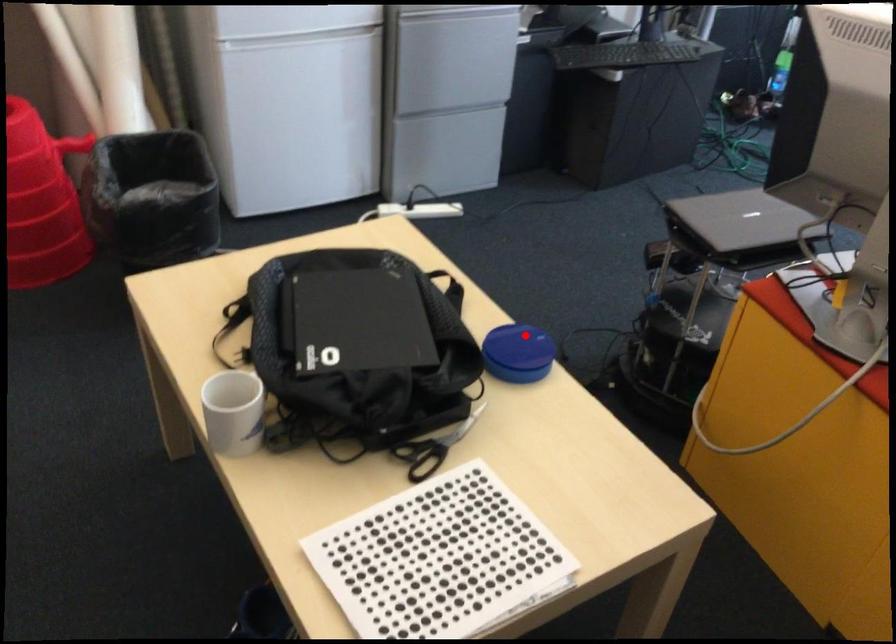
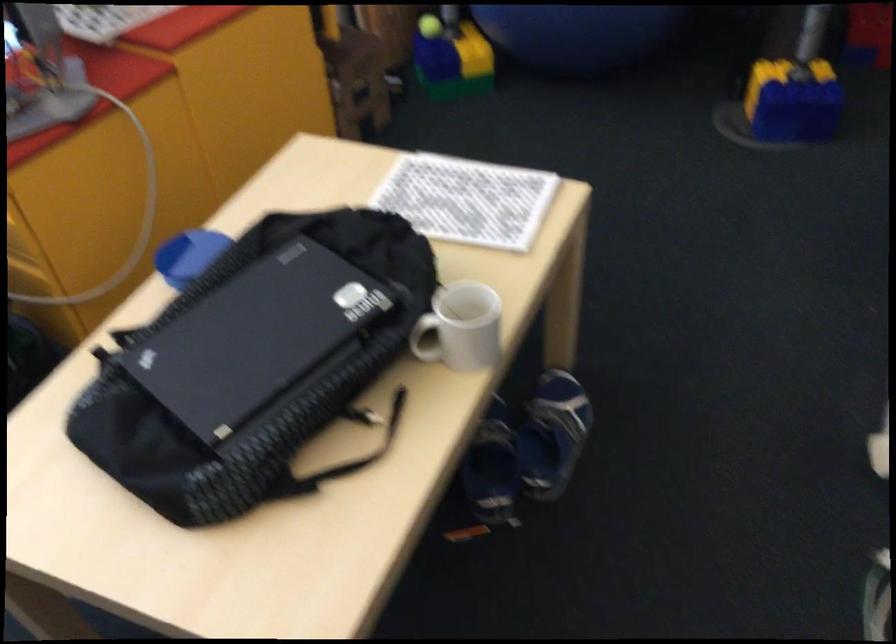
Locate, in the second image, the point that corresponds to the highlighted location in the first image.

(188, 254)